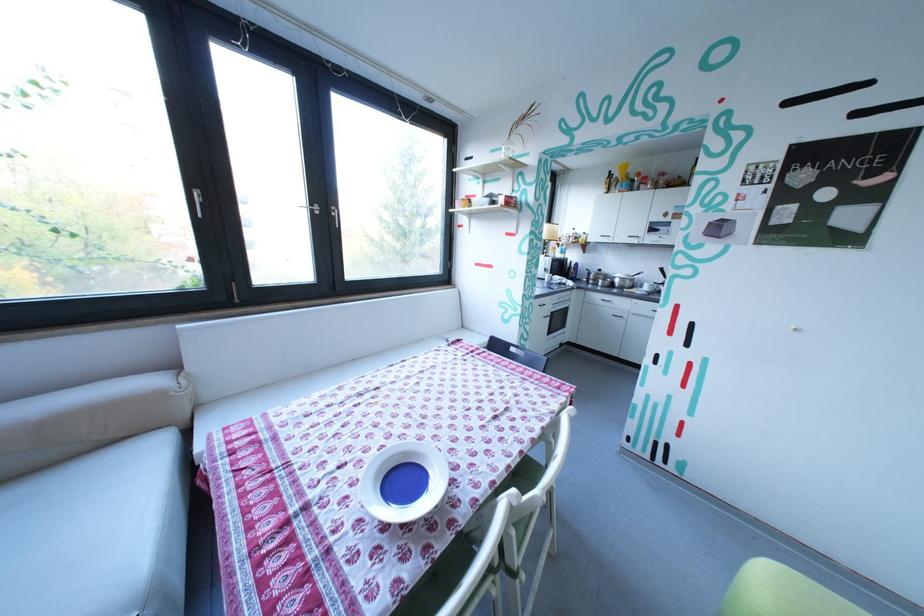
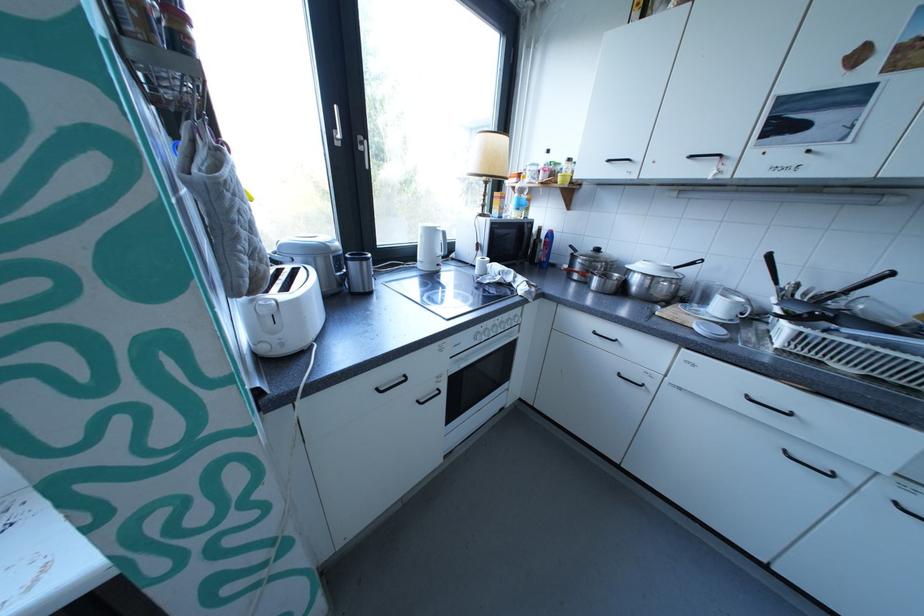
Which direction would the cameraman need to move to produce the second image?

The cameraman walked toward right, forward.